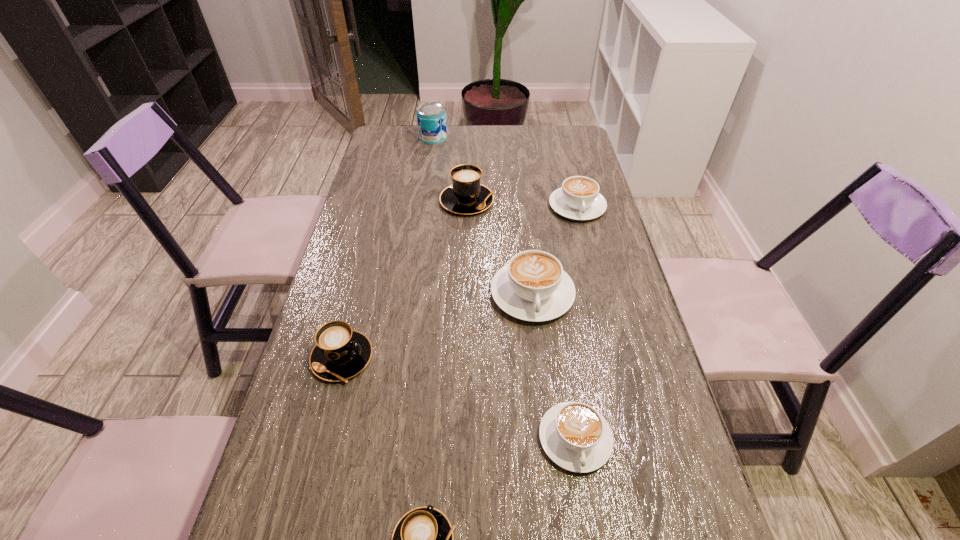
This screenshot has height=540, width=960. What are the coordinates of `object that can be found as the fifth closest to the second biggest white cappuccino` in the screenshot? It's located at [x=340, y=353].

What are the coordinates of `cappuccino identified as the fourth closest to the second nearest object` in the screenshot? It's located at (579, 198).

Point out which cappuccino is positioned as the second nearest to the second biggest white cappuccino. Please provide its 2D coordinates. Your answer should be formatted as a tuple, i.e. [(x, y)], where the tuple contains the x and y coordinates of a point satisfying the conditions above.

[(533, 286)]

At what (x,y) coordinates should I click in order to perform the action: click on black cappuccino that is the closest one to the second farthest black cappuccino. Please return your answer as a coordinate pair (x, y). Looking at the image, I should click on (422, 539).

Find the location of a particular element. black cappuccino that stands as the third closest to the blue can is located at coordinates (422, 539).

I want to click on white cappuccino identified as the closest to the second biggest white cappuccino, so click(x=533, y=286).

Select which white cappuccino appears as the second closest to the biggest white cappuccino. Please provide its 2D coordinates. Your answer should be formatted as a tuple, i.e. [(x, y)], where the tuple contains the x and y coordinates of a point satisfying the conditions above.

[(575, 436)]